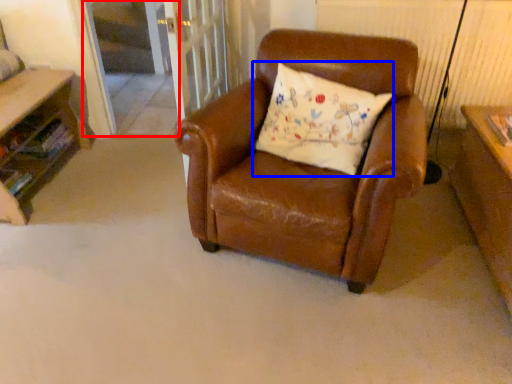
Question: Which of the following is the farthest to the observer, screen door (highlighted by a red box) or pillow (highlighted by a blue box)?

Choices:
 (A) screen door
 (B) pillow

Answer: (A)